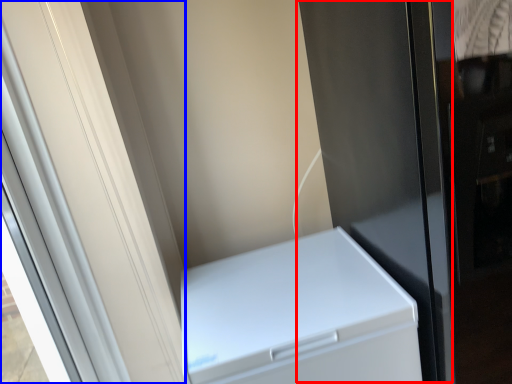
Question: Which object is further to the camera taking this photo, screen door (highlighted by a red box) or screen door (highlighted by a blue box)?

Choices:
 (A) screen door
 (B) screen door

Answer: (A)